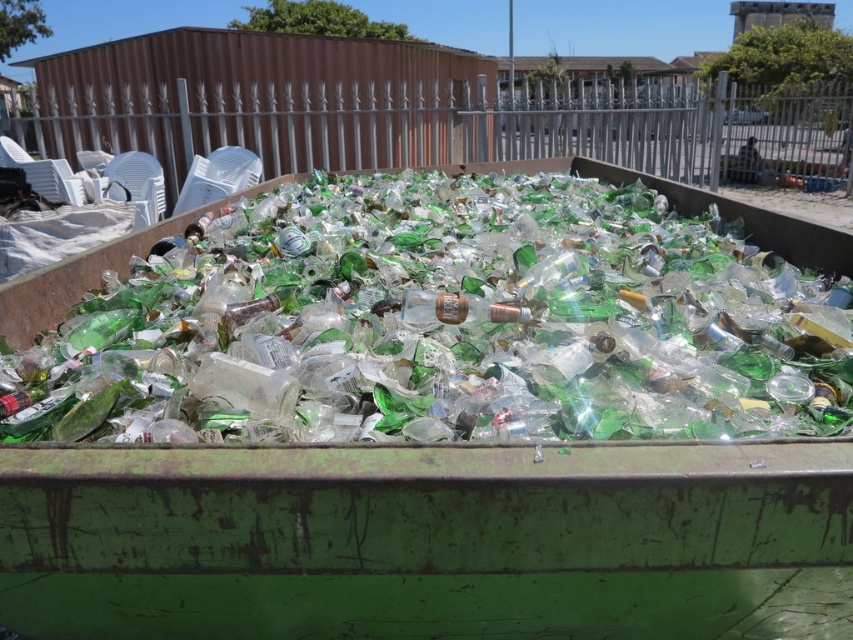
Question: Which point is farther from the camera taking this photo?

Choices:
 (A) (465, 316)
 (B) (648, 353)

Answer: (A)

Question: From the image, what is the correct spatial relationship of green glass bottles at center in relation to clear glass bottle at center?

Choices:
 (A) above
 (B) below

Answer: (A)

Question: Is green glass bottles at center above clear glass bottle at center?

Choices:
 (A) yes
 (B) no

Answer: (A)

Question: Among these objects, which one is farthest from the camera?

Choices:
 (A) green glass bottles at center
 (B) clear glass bottle at center

Answer: (B)

Question: Is green glass bottles at center below clear glass bottle at center?

Choices:
 (A) yes
 (B) no

Answer: (B)